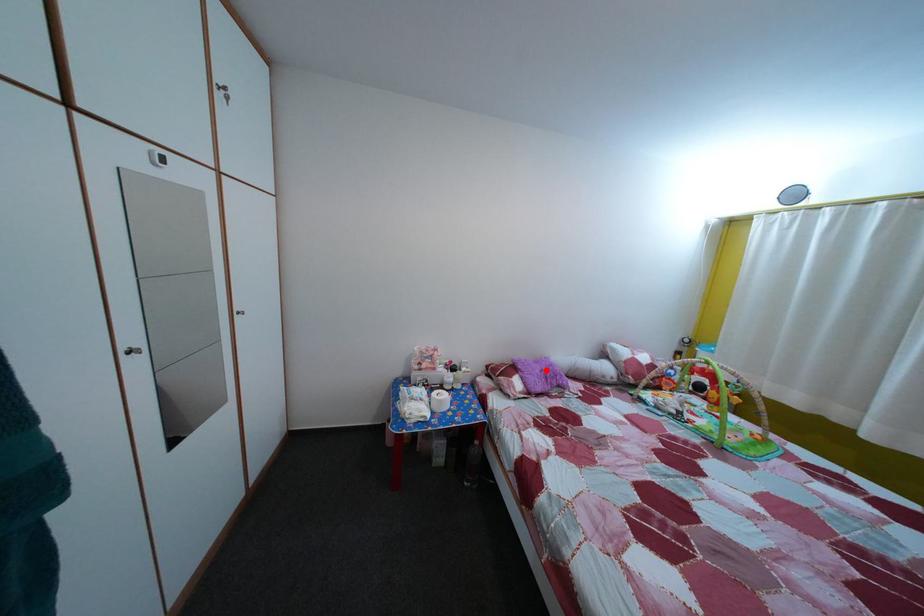
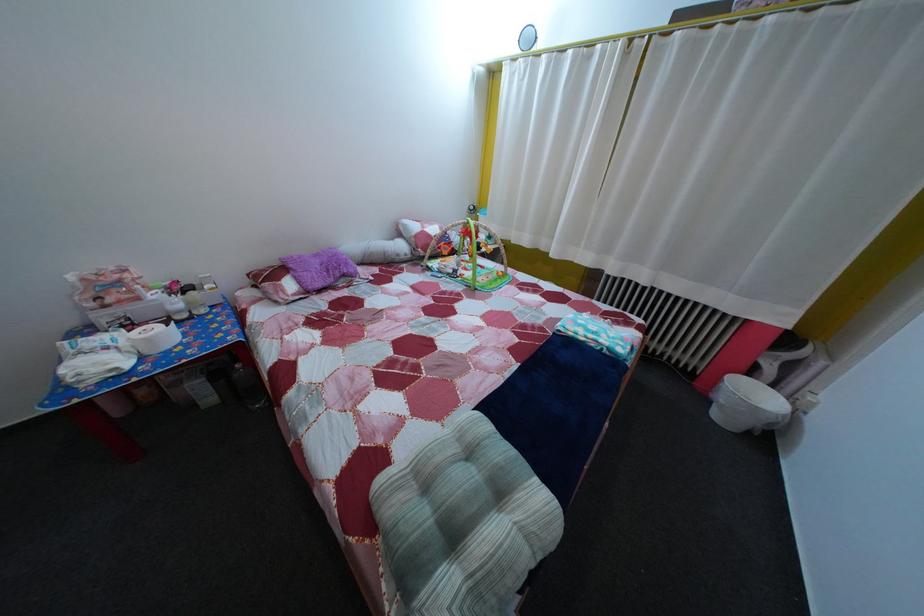
The point at the highlighted location is marked in the first image. Where is the corresponding point in the second image?

(325, 262)